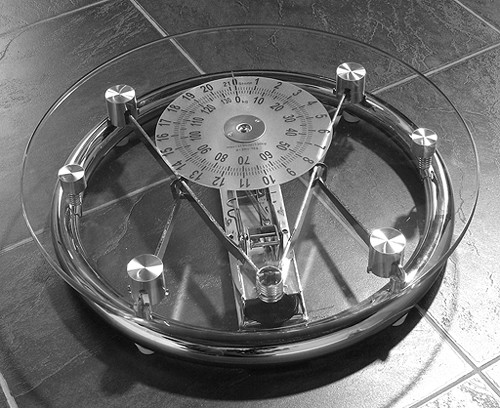
Where is `round knobs`? The height and width of the screenshot is (408, 500). round knobs is located at coordinates (148, 264), (125, 91), (345, 73).